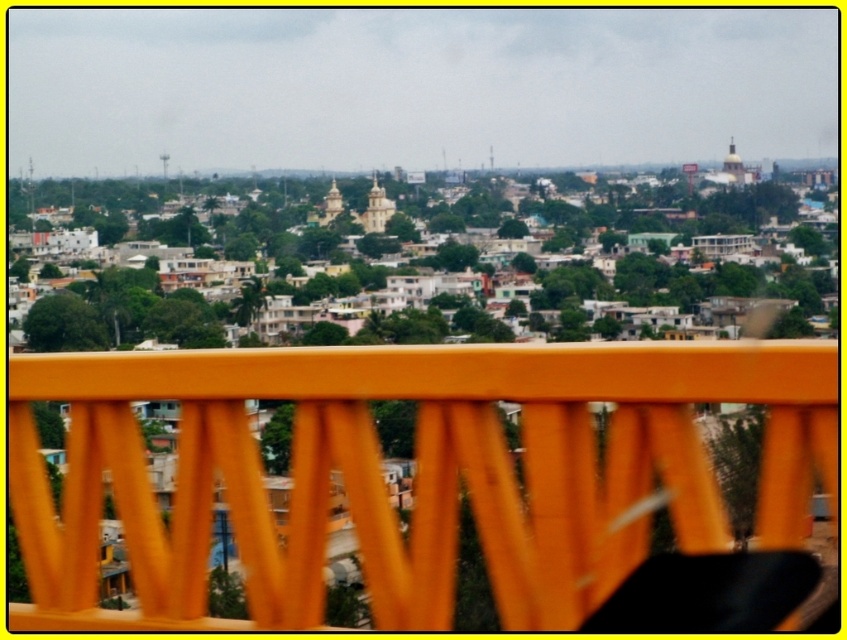
Question: From the image, what is the correct spatial relationship of orange matte rail at center in relation to matte gold dome at upper center?

Choices:
 (A) left
 (B) right

Answer: (A)

Question: Is orange matte rail at center bigger than matte gold dome at upper center?

Choices:
 (A) no
 (B) yes

Answer: (B)

Question: Is orange matte rail at center smaller than matte gold dome at upper center?

Choices:
 (A) yes
 (B) no

Answer: (B)

Question: Which object is closer to the camera taking this photo?

Choices:
 (A) orange matte rail at center
 (B) matte gold dome at upper center

Answer: (A)

Question: Which point is farther to the camera?

Choices:
 (A) orange matte rail at center
 (B) matte gold dome at upper center

Answer: (B)